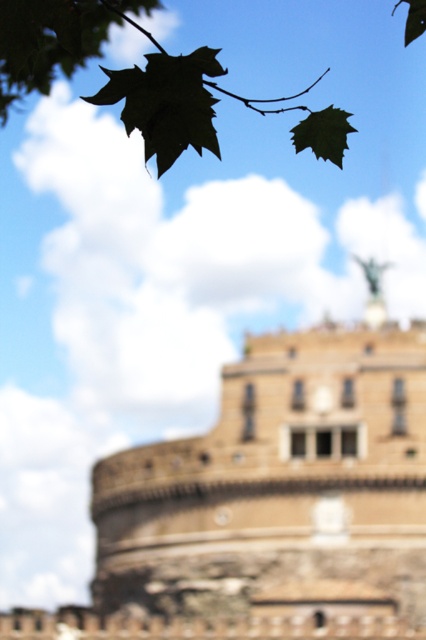
Does brown stone castle at center have a lesser height compared to green matte leaf at upper left?

In fact, brown stone castle at center may be taller than green matte leaf at upper left.

Does point (213, 573) come farther from viewer compared to point (164, 74)?

Yes, it is behind point (164, 74).

Is point (77, 628) in front of point (169, 106)?

That is False.

Locate an element on the screen. The height and width of the screenshot is (640, 426). brown stone castle at center is located at coordinates (270, 500).

Between green leafy branch at upper left and green matte leaf at upper left, which one appears on the left side from the viewer's perspective?

From the viewer's perspective, green matte leaf at upper left appears more on the left side.

Is green leafy branch at upper left above green matte leaf at upper left?

Correct, green leafy branch at upper left is located above green matte leaf at upper left.

Is point (9, 51) farther from camera compared to point (124, 120)?

That is False.

The height and width of the screenshot is (640, 426). Find the location of `green leafy branch at upper left`. green leafy branch at upper left is located at coordinates (138, 77).

Between brown stone castle at center and green matte leaf at upper center, which one is positioned lower?

brown stone castle at center is lower down.

Can you confirm if brown stone castle at center is positioned to the right of green matte leaf at upper center?

No, brown stone castle at center is not to the right of green matte leaf at upper center.

What are the coordinates of `brown stone castle at center` in the screenshot? It's located at (270, 500).